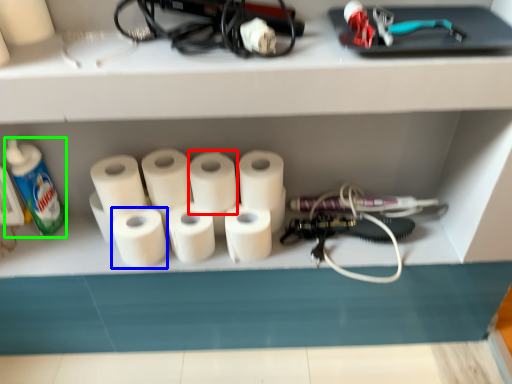
Question: Estimate the real-world distances between objects in this image. Which object is farther from toilet paper (highlighted by a red box), toilet paper (highlighted by a blue box) or bottle (highlighted by a green box)?

Choices:
 (A) toilet paper
 (B) bottle

Answer: (B)